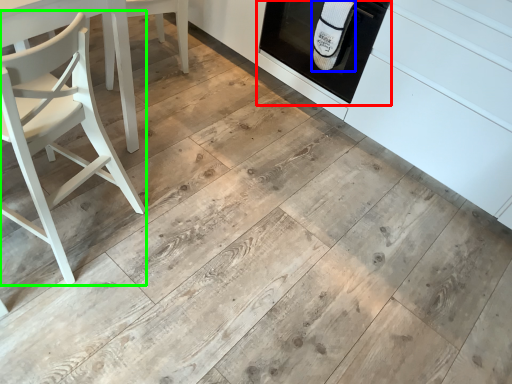
Question: Based on their relative distances, which object is farther from oven (highlighted by a red box)? Choose from material (highlighted by a blue box) and chair (highlighted by a green box).

Choices:
 (A) material
 (B) chair

Answer: (B)